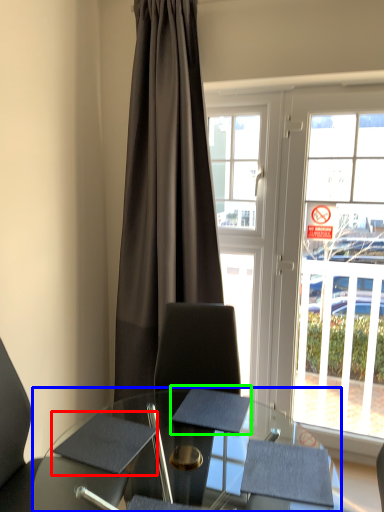
Question: Which is farther away from notepad (highlighted by a red box)? desk (highlighted by a blue box) or notepad (highlighted by a green box)?

Choices:
 (A) desk
 (B) notepad

Answer: (B)